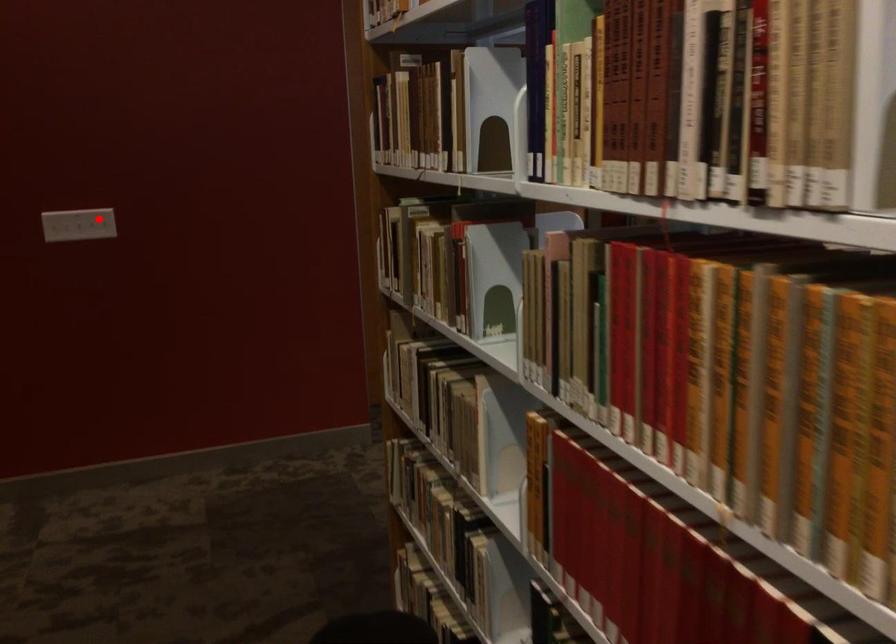
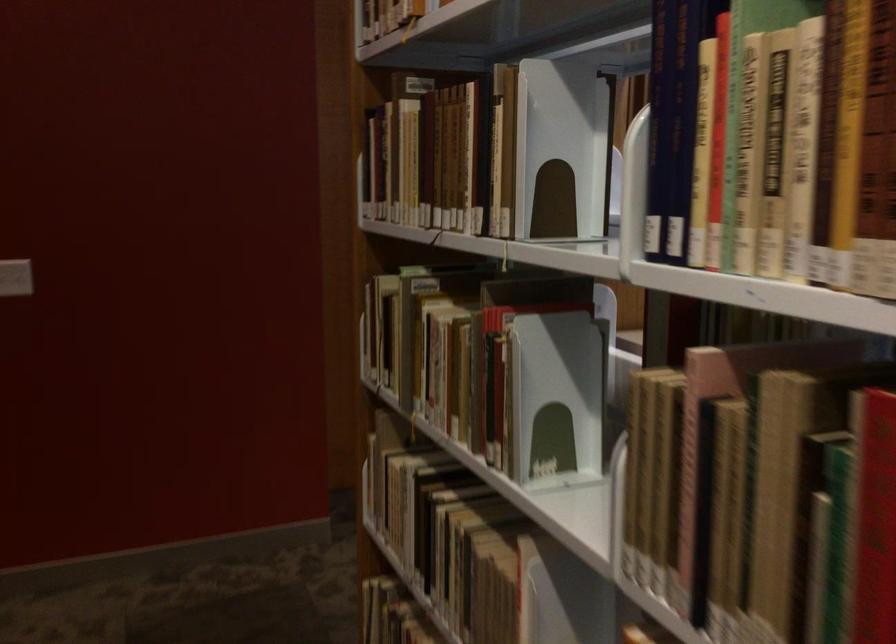
Find the pixel in the second image that matches the highlighted location in the first image.

(15, 277)